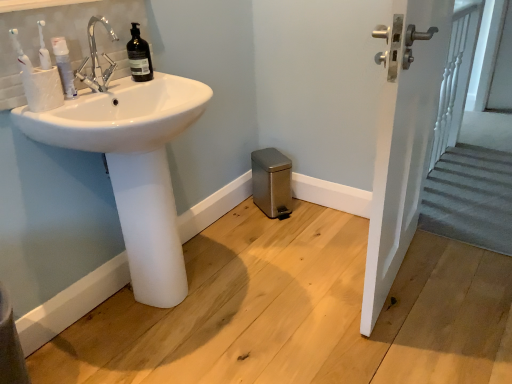
I want to click on vacant space behind white glossy door handle at upper right, so click(x=333, y=226).